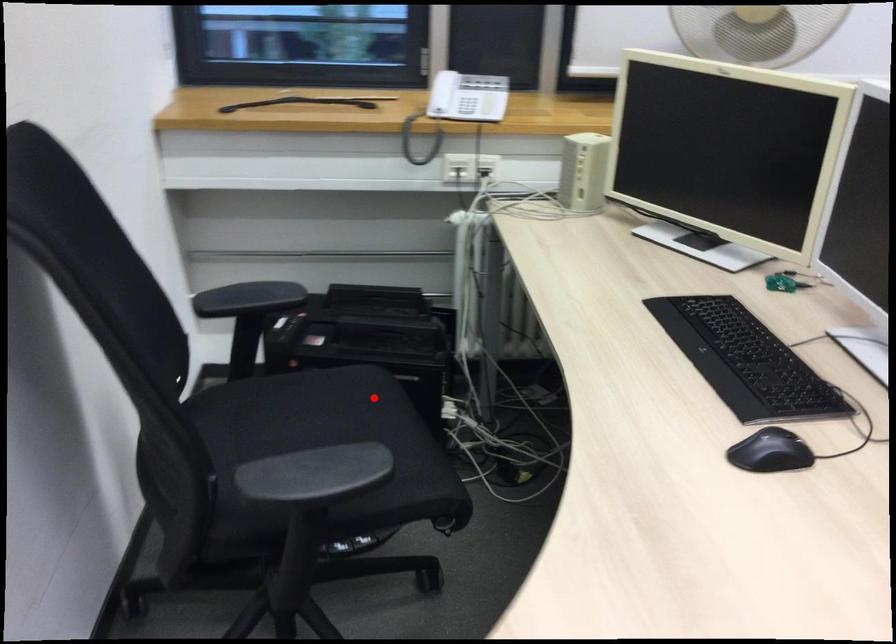
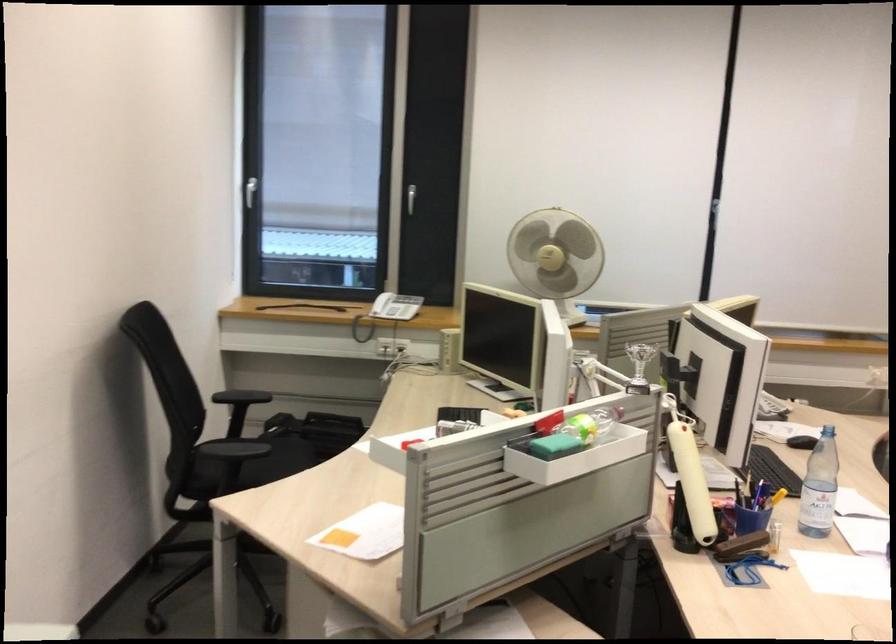
In the second image, find the point that corresponds to the highlighted location in the first image.

(293, 453)